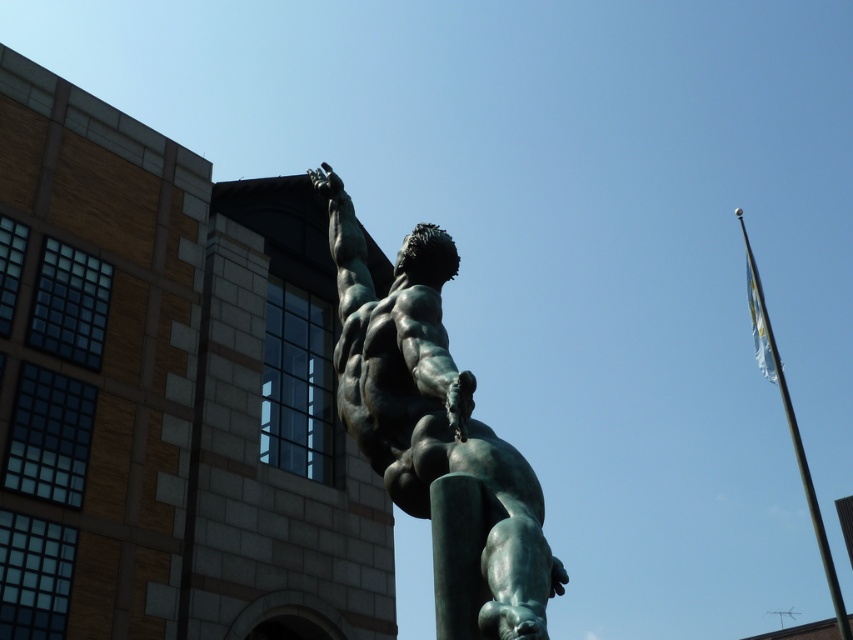
Question: Which point is farther to the camera?

Choices:
 (A) (808, 481)
 (B) (471, 385)

Answer: (A)

Question: Which point is closer to the camera?

Choices:
 (A) metallic flagpole at right
 (B) green patina statue at center

Answer: (B)

Question: Which of the following is the closest to the observer?

Choices:
 (A) (764, 346)
 (B) (415, 275)

Answer: (B)

Question: Can you confirm if green patina statue at center is wider than metallic flagpole at right?

Choices:
 (A) yes
 (B) no

Answer: (B)

Question: Can you confirm if green patina statue at center is positioned above metallic flagpole at right?

Choices:
 (A) yes
 (B) no

Answer: (A)

Question: Is green patina statue at center positioned at the back of metallic flagpole at right?

Choices:
 (A) no
 (B) yes

Answer: (A)